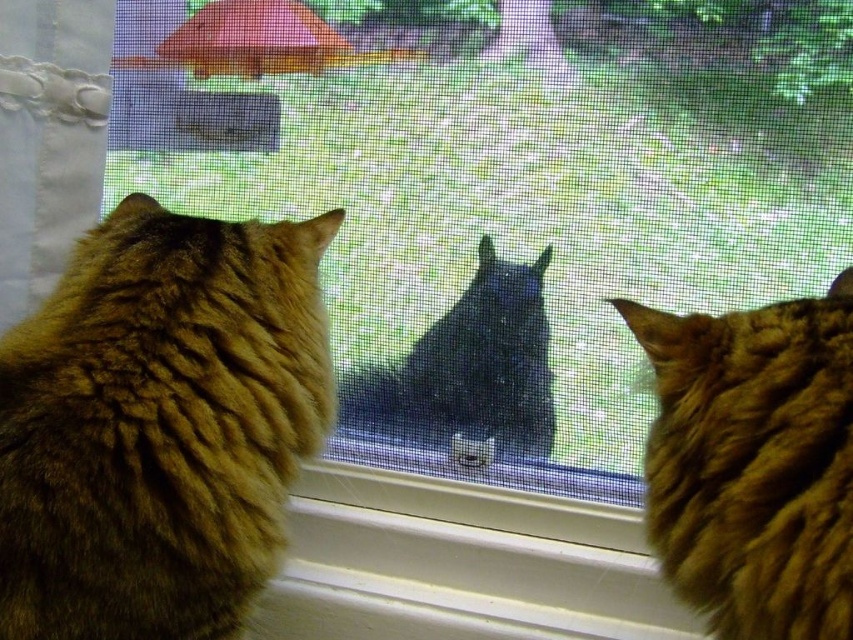
Question: Is fuzzy brown cat at left smaller than fuzzy brown cat at right?

Choices:
 (A) yes
 (B) no

Answer: (B)

Question: Which point appears farthest from the camera in this image?

Choices:
 (A) (26, 339)
 (B) (108, 38)

Answer: (B)

Question: Is the position of white lace curtain at left less distant than that of black fur cat at center?

Choices:
 (A) no
 (B) yes

Answer: (B)

Question: Which object is the farthest from the white lace curtain at left?

Choices:
 (A) black fur cat at center
 (B) fuzzy brown cat at left
 (C) fuzzy brown cat at right

Answer: (C)

Question: Which of these objects is positioned farthest from the black fur cat at center?

Choices:
 (A) white lace curtain at left
 (B) fuzzy brown cat at right
 (C) fuzzy brown cat at left

Answer: (A)

Question: Does white lace curtain at left appear on the left side of black fur cat at center?

Choices:
 (A) no
 (B) yes

Answer: (B)